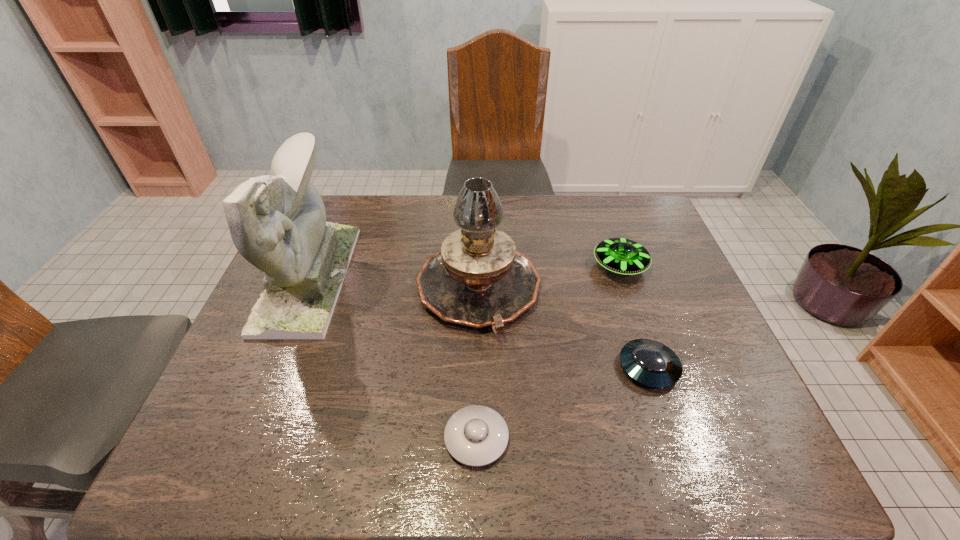
The image size is (960, 540). Identify the location of vacant space at the right edge of the desktop. (679, 288).

This screenshot has height=540, width=960. Identify the location of empty space between the nearest saucer and the second farthest saucer. (563, 403).

Locate an element on the screen. unoccupied area between the fourth shortest object and the fourth farthest object is located at coordinates (564, 329).

Where is `free space between the farthest saucer and the nearest object`? free space between the farthest saucer and the nearest object is located at coordinates (548, 352).

You are a GUI agent. You are given a task and a screenshot of the screen. Output one action in this format:
    pyautogui.click(x=<x>, y=<y>)
    Task: Click on the empty space that is in between the second nearest saucer and the leftmost saucer
    The image size is (960, 540).
    Given the screenshot: What is the action you would take?
    pyautogui.click(x=563, y=403)

Identify the location of empty space between the leftmost saucer and the sculpture. The height and width of the screenshot is (540, 960). (393, 358).

Find the location of `free space between the nearest object and the tallest saucer`. free space between the nearest object and the tallest saucer is located at coordinates (548, 352).

Find the location of a particular element. The height and width of the screenshot is (540, 960). free space between the leftmost saucer and the oil lamp is located at coordinates (477, 364).

Locate an element on the screen. free spot between the oil lamp and the tallest saucer is located at coordinates (549, 278).

Find the location of a particular element. The image size is (960, 540). free space between the farthest saucer and the second farthest saucer is located at coordinates (634, 317).